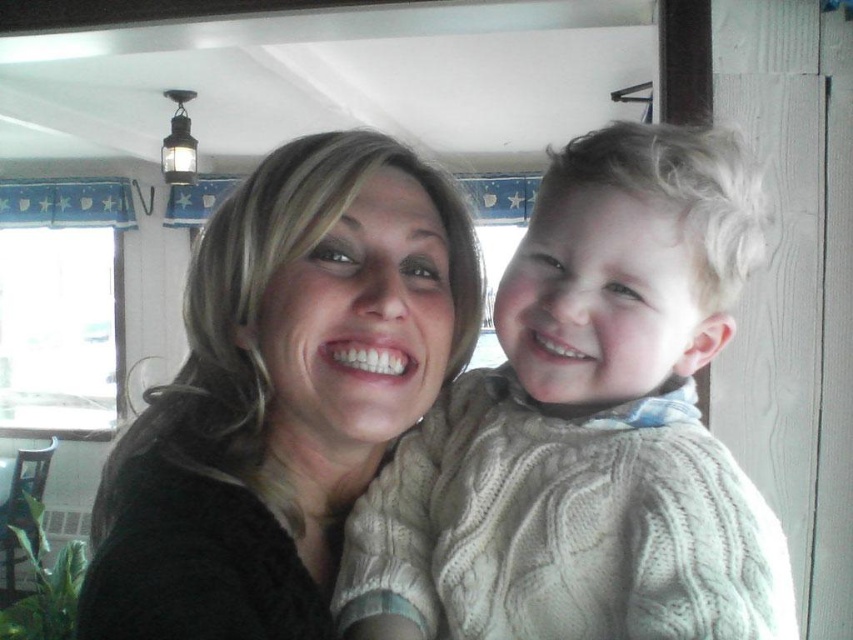
You are organizing a clothing store and need to arrange the creamy knit sweater at center and the matte black sweater at center in a display. According to the image, which sweater should be placed on the left side of the display?

The matte black sweater at center should be placed on the left side of the display because the creamy knit sweater at center is positioned to its right in the image.

You are a fashion designer observing two sweaters in the image. The creamy knit sweater at center and the matte black sweater at center. Which one is nearer to you?

The creamy knit sweater at center is closer to the viewer than the matte black sweater at center.